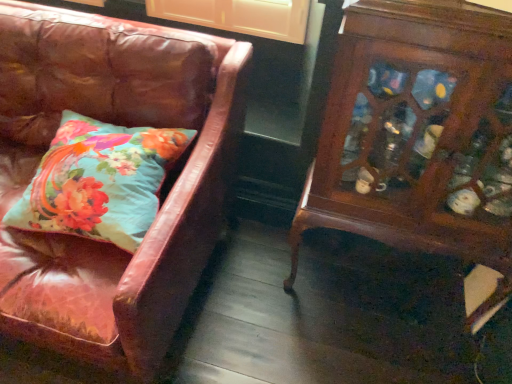
The height and width of the screenshot is (384, 512). Identify the location of leather couch at left. [x=121, y=125].

Is leather couch at left closer to the viewer compared to teal floral pillow at left?

Yes, the depth of leather couch at left is less than that of teal floral pillow at left.

Measure the distance between leather couch at left and teal floral pillow at left.

A distance of 5.97 inches exists between leather couch at left and teal floral pillow at left.

Between leather couch at left and teal floral pillow at left, which one has more height?

leather couch at left.

Does leather couch at left have a smaller size compared to teal floral pillow at left?

Actually, leather couch at left might be larger than teal floral pillow at left.

Locate an element on the screen. Image resolution: width=512 pixels, height=384 pixels. chair that appears in front of the wooden cabinet at right is located at coordinates (121, 125).

In the image, is wooden cabinet at right positioned in front of or behind leather couch at left?

In the image, wooden cabinet at right appears behind leather couch at left.

Does point (403, 54) lie in front of point (53, 109)?

Yes, it is in front of point (53, 109).

Between wooden cabinet at right and leather couch at left, which one has larger size?

With larger size is leather couch at left.

Considering the sizes of objects leather couch at left and wooden cabinet at right in the image provided, who is shorter, leather couch at left or wooden cabinet at right?

leather couch at left.

Which is closer to the camera, (158, 222) or (479, 86)?

Point (158, 222) is farther from the camera than point (479, 86).

Does leather couch at left have a smaller size compared to wooden cabinet at right?

No, leather couch at left is not smaller than wooden cabinet at right.

Which object is more forward, leather couch at left or wooden cabinet at right?

leather couch at left.

Which object is closer to the camera taking this photo, teal floral pillow at left or leather couch at left?

leather couch at left is closer to the camera.

From a real-world perspective, which object stands above the other?

teal floral pillow at left is physically above.

From the image's perspective, does teal floral pillow at left appear lower than leather couch at left?

No.

Is point (129, 230) closer or farther from the camera than point (377, 172)?

Clearly, point (129, 230) is closer to the camera than point (377, 172).

Would you consider teal floral pillow at left to be distant from wooden cabinet at right?

teal floral pillow at left is near wooden cabinet at right, not far away.

Is teal floral pillow at left smaller than wooden cabinet at right?

Yes, teal floral pillow at left is smaller than wooden cabinet at right.

From the image's perspective, between teal floral pillow at left and wooden cabinet at right, who is located below?

wooden cabinet at right.

Who is shorter, wooden cabinet at right or teal floral pillow at left?

teal floral pillow at left is shorter.

From a real-world perspective, is wooden cabinet at right positioned over teal floral pillow at left based on gravity?

Incorrect, from a real-world perspective, wooden cabinet at right is lower than teal floral pillow at left.

Is wooden cabinet at right with teal floral pillow at left?

wooden cabinet at right is not next to teal floral pillow at left, and they're not touching.

In the scene shown: Does wooden cabinet at right turn towards teal floral pillow at left?

No, wooden cabinet at right does not turn towards teal floral pillow at left.

Locate an element on the screen. chair in front of the teal floral pillow at left is located at coordinates (121, 125).

This screenshot has width=512, height=384. Find the location of `furniture located on the right of leather couch at left`. furniture located on the right of leather couch at left is located at coordinates (411, 128).

From the image, which object appears to be nearer to wooden cabinet at right, teal floral pillow at left or leather couch at left?

Among the two, leather couch at left is located nearer to wooden cabinet at right.

From the image, which object appears to be farther from wooden cabinet at right, leather couch at left or teal floral pillow at left?

teal floral pillow at left is positioned further to the anchor wooden cabinet at right.

Looking at the image, which one is located closer to leather couch at left, wooden cabinet at right or teal floral pillow at left?

teal floral pillow at left.

Which object lies further to the anchor point leather couch at left, teal floral pillow at left or wooden cabinet at right?

Among the two, wooden cabinet at right is located further to leather couch at left.

When comparing their distances from teal floral pillow at left, does wooden cabinet at right or leather couch at left seem closer?

leather couch at left.

Considering their positions, is leather couch at left positioned further to teal floral pillow at left than wooden cabinet at right?

Based on the image, wooden cabinet at right appears to be further to teal floral pillow at left.

Locate an element on the screen. Image resolution: width=512 pixels, height=384 pixels. pillow situated between leather couch at left and wooden cabinet at right from left to right is located at coordinates (99, 181).